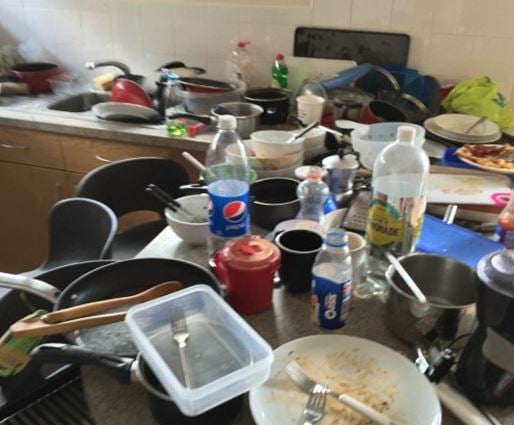
Find the location of `forks`. forks is located at coordinates [x=178, y=323], [x=314, y=406], [x=297, y=379].